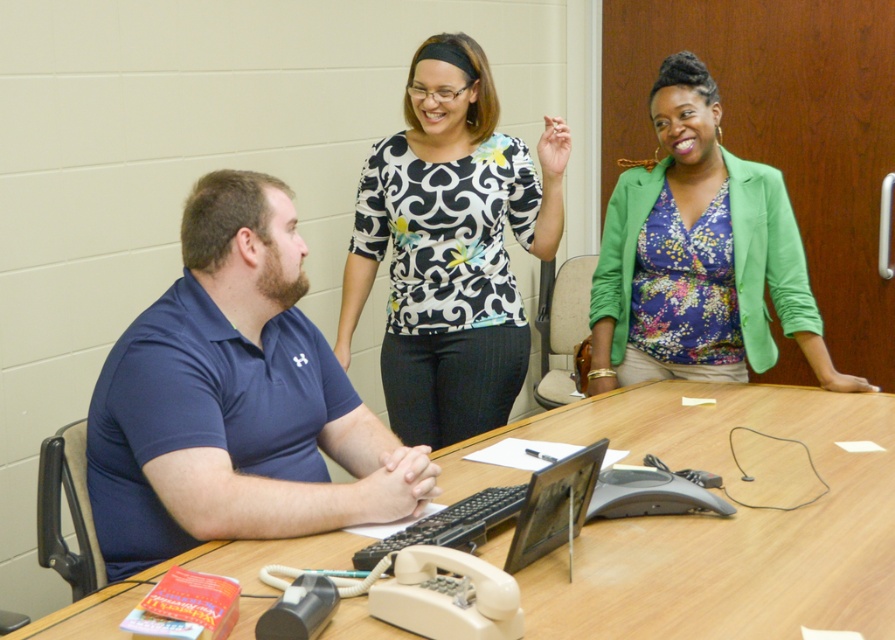
You are a service robot with a 1.0 meter wide base. You need to move from the blue cotton polo shirt at center to the floral fabric blouse at upper right. Is there enough space for you to pass through the area between them?

The distance between the blue cotton polo shirt at center and the floral fabric blouse at upper right is 1.20 meters. Since your base is 1.0 meter wide, you can safely pass through the space between them as it is wider than your width.

You are a new employee entering the office and see the wooden table at center and the black and white printed blouse at center. Which object is closer to you from your vantage point?

The wooden table at center is closer to you because it is positioned in front of the black and white printed blouse at center.

You are organizing a team meeting and need to identify participants based on their clothing. There is a blue cotton polo shirt at center and a floral fabric blouse at upper right. Which participant is positioned to the left of the other?

The blue cotton polo shirt at center is positioned on the left side of the floral fabric blouse at upper right.